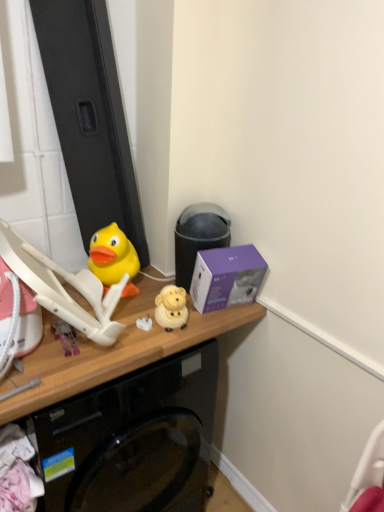
Identify the location of vacant area in front of white matte plug at center, which appears as the third toy when viewed from the left. (130, 349).